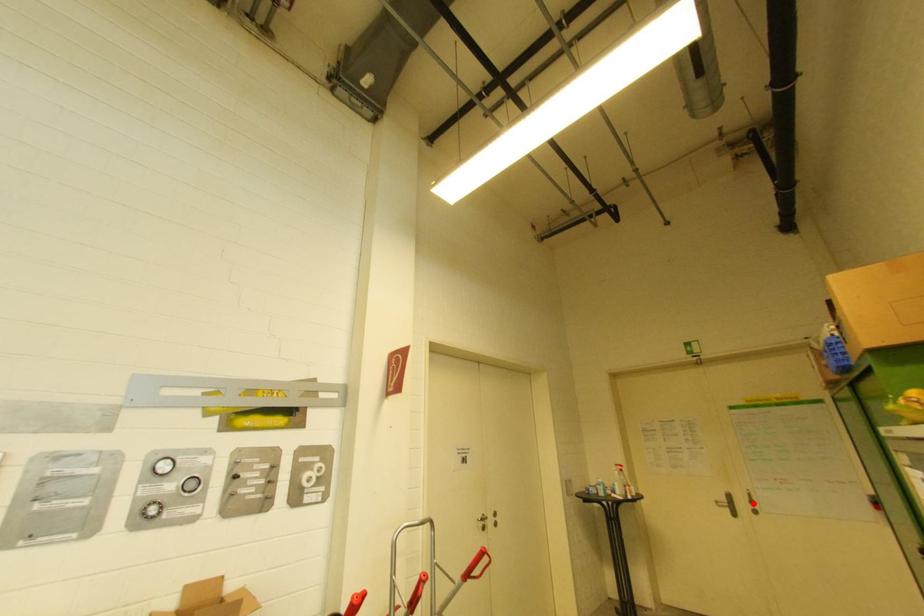
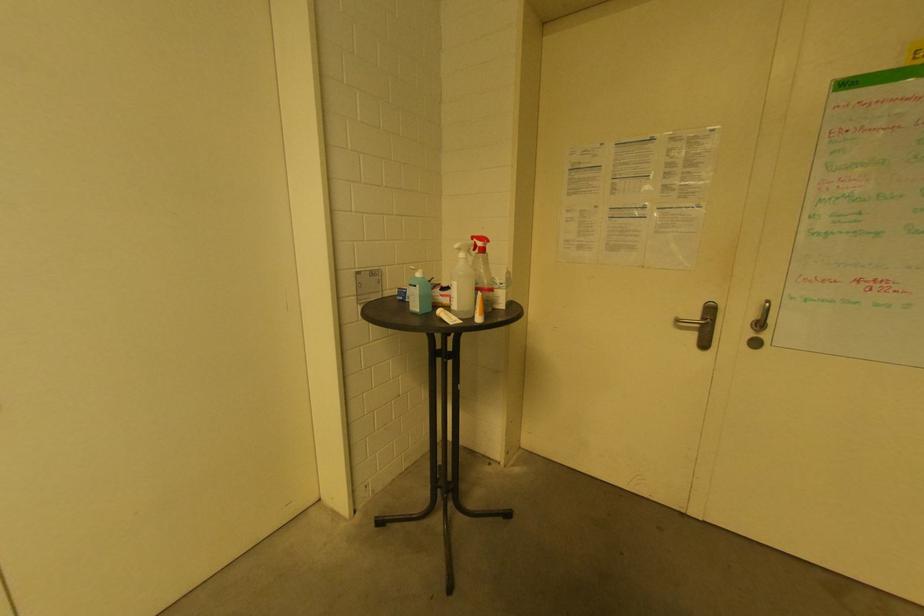
Where in the second image is the point corresponding to the highlighted location from the first image?

(761, 326)